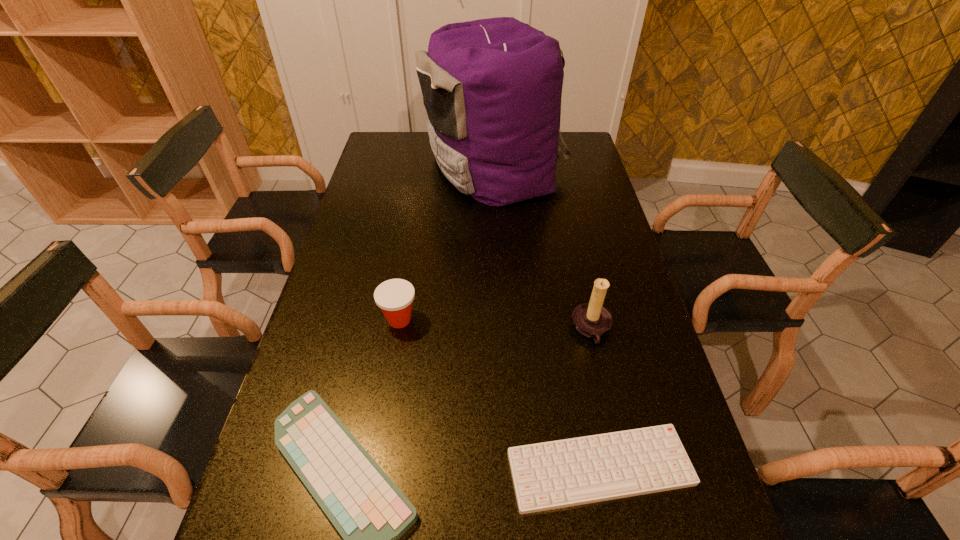
Where is `free location that satisfies the following two spatial constraints: 1. on the front pocket of the farthest object; 2. on the back side of the right computer keyboard`? free location that satisfies the following two spatial constraints: 1. on the front pocket of the farthest object; 2. on the back side of the right computer keyboard is located at coordinates (506, 468).

You are a GUI agent. You are given a task and a screenshot of the screen. Output one action in this format:
    pyautogui.click(x=<x>, y=<y>)
    Task: Click on the free point that satisfies the following two spatial constraints: 1. on the wick of the candle holder; 2. on the front side of the right computer keyboard
    
    Given the screenshot: What is the action you would take?
    pyautogui.click(x=622, y=468)